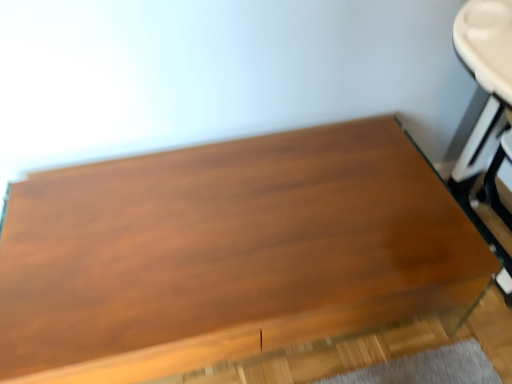
Where is `free space above satin wood table at center (from a real-world perspective)`? free space above satin wood table at center (from a real-world perspective) is located at coordinates (181, 243).